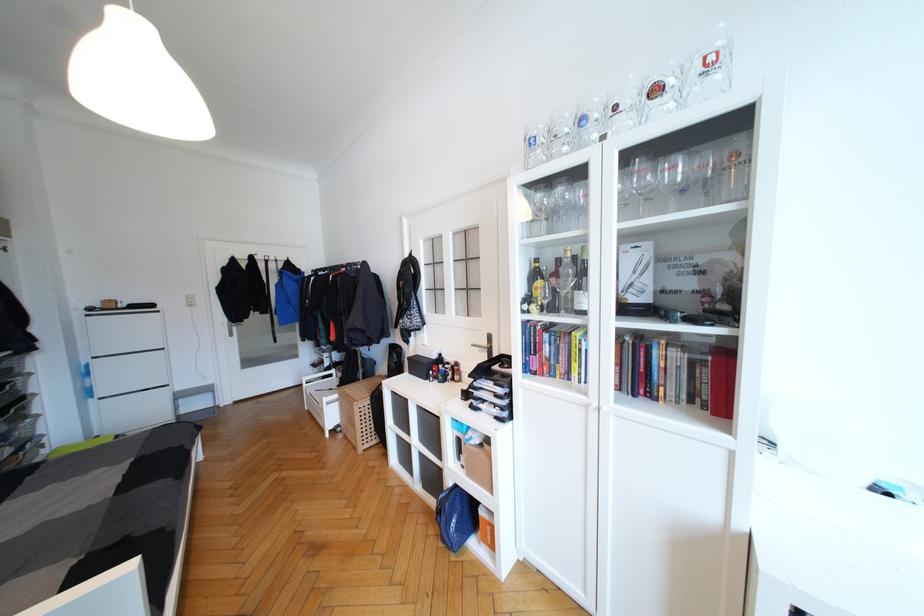
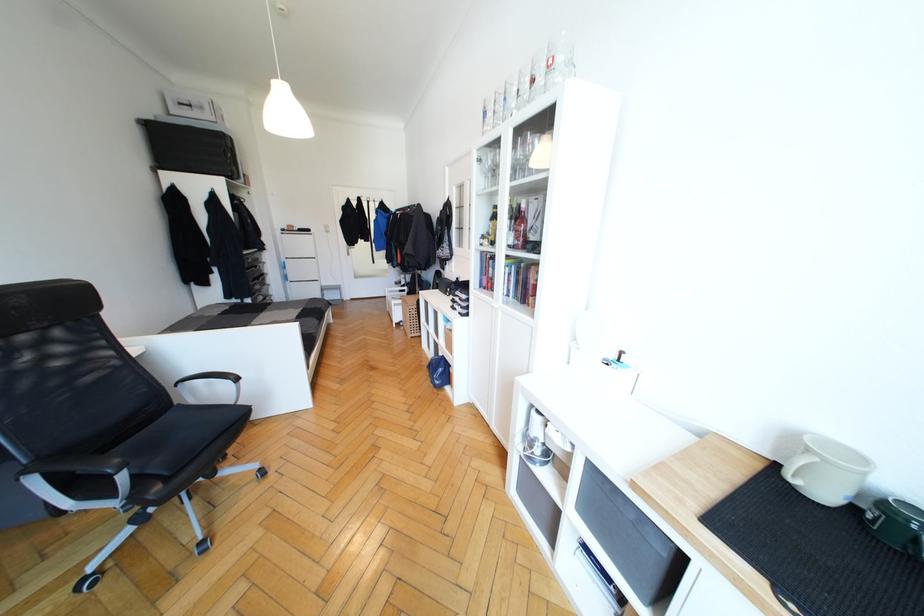
In the second image, find the point that corresponds to point 460,501 in the first image.

(445, 363)